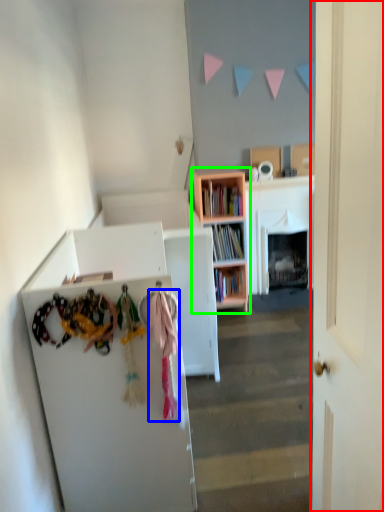
Question: Based on their relative distances, which object is nearer to door (highlighted by a red box)? Choose from clothing (highlighted by a blue box) and bookcase (highlighted by a green box).

Choices:
 (A) clothing
 (B) bookcase

Answer: (A)